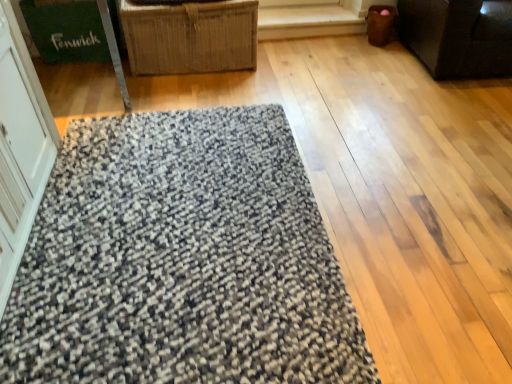
What is the approximate height of woven straw basket at upper center, which is counted as the first furniture, starting from the left?

It is 18.22 inches.

Identify the location of dark brown fabric couch at upper right, which ranks as the first furniture in right-to-left order. (459, 36).

Does green cardboard box at upper left turn towards textured gray mat at center?

Yes, green cardboard box at upper left is oriented towards textured gray mat at center.

Looking at this image, from a real-world perspective, is green cardboard box at upper left on top of textured gray mat at center?

Yes, from a real-world perspective, green cardboard box at upper left is on top of textured gray mat at center.

Is green cardboard box at upper left in front of textured gray mat at center?

No, green cardboard box at upper left is further to the viewer.

Does green cardboard box at upper left appear on the left side of textured gray mat at center?

Correct, you'll find green cardboard box at upper left to the left of textured gray mat at center.

Can you confirm if white glossy screen door at left is positioned to the right of dark brown fabric couch at upper right, which appears as the 2th furniture when viewed from the left?

Incorrect, white glossy screen door at left is not on the right side of dark brown fabric couch at upper right, which appears as the 2th furniture when viewed from the left.

Is white glossy screen door at left in front of dark brown fabric couch at upper right, which ranks as the first furniture in right-to-left order?

That is True.

From the image's perspective, is white glossy screen door at left located above or below dark brown fabric couch at upper right, which appears as the 2th furniture when viewed from the left?

From the image's perspective, white glossy screen door at left appears below dark brown fabric couch at upper right, which appears as the 2th furniture when viewed from the left.

Considering the sizes of objects white glossy screen door at left and dark brown fabric couch at upper right, which ranks as the first furniture in right-to-left order, in the image provided, who is bigger, white glossy screen door at left or dark brown fabric couch at upper right, which ranks as the first furniture in right-to-left order,?

Bigger between the two is dark brown fabric couch at upper right, which ranks as the first furniture in right-to-left order.

Considering the relative sizes of white glossy screen door at left and woven straw basket at upper center, which ranks as the second furniture in right-to-left order, in the image provided, is white glossy screen door at left smaller than woven straw basket at upper center, which ranks as the second furniture in right-to-left order,?

Actually, white glossy screen door at left might be larger than woven straw basket at upper center, which ranks as the second furniture in right-to-left order.

Does white glossy screen door at left touch woven straw basket at upper center, which is counted as the first furniture, starting from the left?

white glossy screen door at left is not next to woven straw basket at upper center, which is counted as the first furniture, starting from the left, and they're not touching.

From the image's perspective, which one is positioned higher, white glossy screen door at left or woven straw basket at upper center, which ranks as the second furniture in right-to-left order?

woven straw basket at upper center, which ranks as the second furniture in right-to-left order, is shown above in the image.

Locate an element on the screen. This screenshot has width=512, height=384. screen door below the woven straw basket at upper center, which is counted as the first furniture, starting from the left (from the image's perspective) is located at coordinates (20, 147).

Which of these two, green cardboard box at upper left or white glossy screen door at left, stands shorter?

green cardboard box at upper left is shorter.

Which is more to the right, green cardboard box at upper left or white glossy screen door at left?

Positioned to the right is white glossy screen door at left.

Which is closer to the camera, [99,33] or [1,7]?

Clearly, point [99,33] is more distant from the camera than point [1,7].

Which is correct: green cardboard box at upper left is inside white glossy screen door at left, or outside of it?

The correct answer is: outside.

Is textured gray mat at center next to woven straw basket at upper center, which ranks as the second furniture in right-to-left order?

No, textured gray mat at center is not beside woven straw basket at upper center, which ranks as the second furniture in right-to-left order.

Between point (271, 240) and point (174, 52), which one is positioned in front?

Point (271, 240)

From the image's perspective, does textured gray mat at center appear higher than woven straw basket at upper center, which is counted as the first furniture, starting from the left?

Incorrect, from the image's perspective, textured gray mat at center is lower than woven straw basket at upper center, which is counted as the first furniture, starting from the left.

In terms of size, does textured gray mat at center appear bigger or smaller than woven straw basket at upper center, which ranks as the second furniture in right-to-left order?

Clearly, textured gray mat at center is smaller in size than woven straw basket at upper center, which ranks as the second furniture in right-to-left order.

Between point (153, 37) and point (98, 42), which one is positioned in front?

Point (153, 37)

From the image's perspective, which one is positioned higher, woven straw basket at upper center, which is counted as the first furniture, starting from the left, or green cardboard box at upper left?

green cardboard box at upper left, from the image's perspective.

Is woven straw basket at upper center, which ranks as the second furniture in right-to-left order, facing towards green cardboard box at upper left?

No, woven straw basket at upper center, which ranks as the second furniture in right-to-left order, is not aimed at green cardboard box at upper left.

Which object is wider, woven straw basket at upper center, which ranks as the second furniture in right-to-left order, or green cardboard box at upper left?

woven straw basket at upper center, which ranks as the second furniture in right-to-left order.

Does point (429, 35) lie behind point (132, 21)?

Yes, point (429, 35) is behind point (132, 21).

Considering the sizes of dark brown fabric couch at upper right, which ranks as the first furniture in right-to-left order, and woven straw basket at upper center, which ranks as the second furniture in right-to-left order, in the image, is dark brown fabric couch at upper right, which ranks as the first furniture in right-to-left order, taller or shorter than woven straw basket at upper center, which ranks as the second furniture in right-to-left order,?

Considering their sizes, dark brown fabric couch at upper right, which ranks as the first furniture in right-to-left order, has more height than woven straw basket at upper center, which ranks as the second furniture in right-to-left order.

Can you tell me how much dark brown fabric couch at upper right, which ranks as the first furniture in right-to-left order, and woven straw basket at upper center, which ranks as the second furniture in right-to-left order, differ in facing direction?

0.152 degrees.

Can you confirm if dark brown fabric couch at upper right, which ranks as the first furniture in right-to-left order, is positioned to the left of woven straw basket at upper center, which ranks as the second furniture in right-to-left order?

No, dark brown fabric couch at upper right, which ranks as the first furniture in right-to-left order, is not to the left of woven straw basket at upper center, which ranks as the second furniture in right-to-left order.

Identify the location of mat on the right side of green cardboard box at upper left. (181, 260).

Image resolution: width=512 pixels, height=384 pixels. Find the location of `the 1st furniture behind the white glossy screen door at left, starting your count from the anchor`. the 1st furniture behind the white glossy screen door at left, starting your count from the anchor is located at coordinates (459, 36).

From the image, which object appears to be nearer to dark brown fabric couch at upper right, which ranks as the first furniture in right-to-left order, woven straw basket at upper center, which is counted as the first furniture, starting from the left, or white glossy screen door at left?

Based on the image, woven straw basket at upper center, which is counted as the first furniture, starting from the left, appears to be nearer to dark brown fabric couch at upper right, which ranks as the first furniture in right-to-left order.

Based on their spatial positions, is woven straw basket at upper center, which ranks as the second furniture in right-to-left order, or white glossy screen door at left further from green cardboard box at upper left?

The object further to green cardboard box at upper left is white glossy screen door at left.

Which object lies further to the anchor point white glossy screen door at left, green cardboard box at upper left or woven straw basket at upper center, which ranks as the second furniture in right-to-left order?

green cardboard box at upper left is positioned further to the anchor white glossy screen door at left.

When comparing their distances from green cardboard box at upper left, does dark brown fabric couch at upper right, which ranks as the first furniture in right-to-left order, or white glossy screen door at left seem closer?

Based on the image, white glossy screen door at left appears to be nearer to green cardboard box at upper left.

Based on their spatial positions, is green cardboard box at upper left or textured gray mat at center closer to white glossy screen door at left?

textured gray mat at center is positioned closer to the anchor white glossy screen door at left.

Based on their spatial positions, is white glossy screen door at left or textured gray mat at center closer to woven straw basket at upper center, which ranks as the second furniture in right-to-left order?

white glossy screen door at left is positioned closer to the anchor woven straw basket at upper center, which ranks as the second furniture in right-to-left order.

When comparing their distances from woven straw basket at upper center, which is counted as the first furniture, starting from the left, does dark brown fabric couch at upper right, which ranks as the first furniture in right-to-left order, or white glossy screen door at left seem further?

dark brown fabric couch at upper right, which ranks as the first furniture in right-to-left order, lies further to woven straw basket at upper center, which is counted as the first furniture, starting from the left, than the other object.

Considering their positions, is dark brown fabric couch at upper right, which appears as the 2th furniture when viewed from the left, positioned further to textured gray mat at center than white glossy screen door at left?

dark brown fabric couch at upper right, which appears as the 2th furniture when viewed from the left, is further to textured gray mat at center.

Locate an element on the screen. The height and width of the screenshot is (384, 512). mat located between white glossy screen door at left and dark brown fabric couch at upper right, which ranks as the first furniture in right-to-left order, in the left-right direction is located at coordinates (181, 260).

Where is `mat situated between woven straw basket at upper center, which ranks as the second furniture in right-to-left order, and dark brown fabric couch at upper right, which appears as the 2th furniture when viewed from the left, from left to right`? mat situated between woven straw basket at upper center, which ranks as the second furniture in right-to-left order, and dark brown fabric couch at upper right, which appears as the 2th furniture when viewed from the left, from left to right is located at coordinates (181, 260).

This screenshot has height=384, width=512. What are the coordinates of `mat positioned between white glossy screen door at left and woven straw basket at upper center, which is counted as the first furniture, starting from the left, from near to far` in the screenshot? It's located at (181, 260).

Locate an element on the screen. furniture between white glossy screen door at left and dark brown fabric couch at upper right, which ranks as the first furniture in right-to-left order, from left to right is located at coordinates (190, 37).